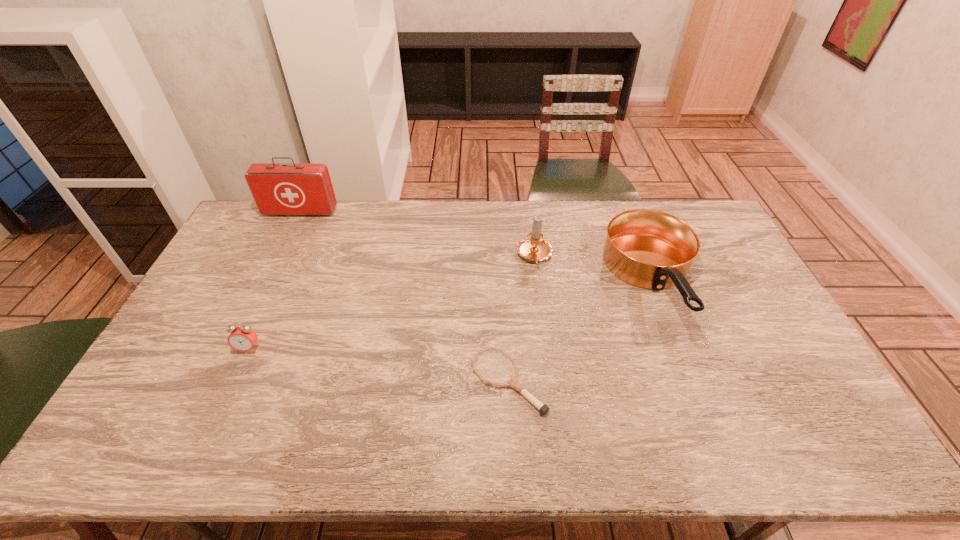
This screenshot has width=960, height=540. What are the coordinates of `vacant region between the shortest object and the frying pan` in the screenshot? It's located at (581, 333).

Locate which object ranks in proximity to the farthest object. Please provide its 2D coordinates. Your answer should be formatted as a tuple, i.e. [(x, y)], where the tuple contains the x and y coordinates of a point satisfying the conditions above.

[(242, 338)]

Locate which object is the fourth closest to the candle. Please provide its 2D coordinates. Your answer should be formatted as a tuple, i.e. [(x, y)], where the tuple contains the x and y coordinates of a point satisfying the conditions above.

[(242, 338)]

At what (x,y) coordinates should I click in order to perform the action: click on vacant region that satisfies the following two spatial constraints: 1. on the side of the tennis racket with the first aid cross symbol; 2. on the right side of the farthest object. Please return your answer as a coordinate pair (x, y). Looking at the image, I should click on (219, 382).